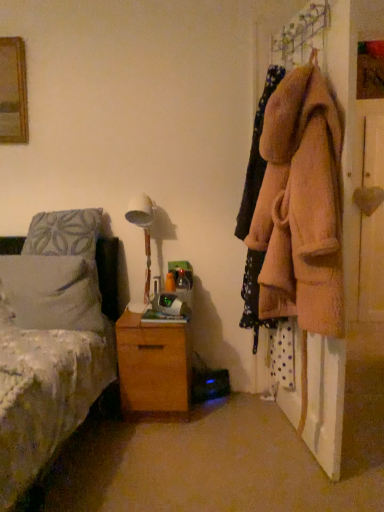
Question: Does point (294, 413) appear closer or farther from the camera than point (261, 161)?

Choices:
 (A) closer
 (B) farther

Answer: (B)

Question: Looking at their shapes, would you say fuzzy pink coat at right is wider or thinner than fuzzy beige coat at right?

Choices:
 (A) wide
 (B) thin

Answer: (A)

Question: Estimate the real-world distances between objects in this image. Which object is closer to the fuzzy pink coat at right?

Choices:
 (A) wooden chest of drawers at lower center
 (B) white fabric lampshade at center
 (C) white soft pillow at left
 (D) fuzzy beige coat at right
 (E) wooden heart at right

Answer: (D)

Question: Considering the real-world distances, which object is closest to the wooden chest of drawers at lower center?

Choices:
 (A) fuzzy beige coat at right
 (B) wooden heart at right
 (C) white fabric lampshade at center
 (D) fuzzy pink coat at right
 (E) white soft pillow at left

Answer: (E)